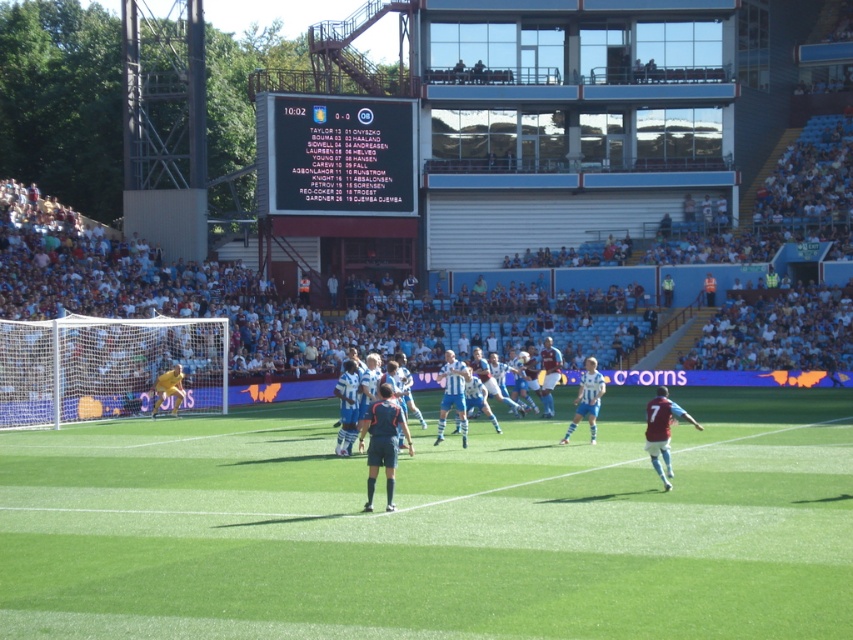
Question: Is black plastic scoreboard at upper center above blue jersey at center?

Choices:
 (A) yes
 (B) no

Answer: (A)

Question: Which of the following is the farthest from the observer?

Choices:
 (A) (575, 413)
 (B) (468, 560)
 (C) (389, 496)

Answer: (A)

Question: Which is nearer to the green grass field at center?

Choices:
 (A) blue fabric jersey at center
 (B) black plastic scoreboard at upper center
 (C) yellow jersey at left
 (D) dark blue uniform at center

Answer: (A)

Question: Does green grass field at center have a lesser width compared to yellow jersey at left?

Choices:
 (A) yes
 (B) no

Answer: (B)

Question: Does blue jersey at center come behind yellow jersey at left?

Choices:
 (A) yes
 (B) no

Answer: (B)

Question: Estimate the real-world distances between objects in this image. Which object is closer to the black plastic scoreboard at upper center?

Choices:
 (A) yellow jersey at left
 (B) blue jersey at center
 (C) dark blue uniform at center
 (D) blue fabric jersey at center

Answer: (D)